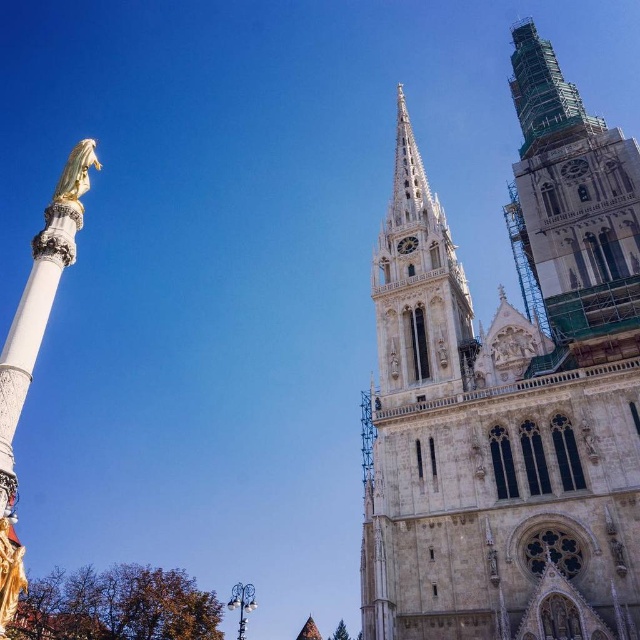
Question: Which object appears closest to the camera in this image?

Choices:
 (A) white marble column at left
 (B) stone spire at center
 (C) green scaffolding at right
 (D) gold polished statue at left

Answer: (A)

Question: Does stone spire at center have a larger size compared to gold polished statue at left?

Choices:
 (A) yes
 (B) no

Answer: (B)

Question: Among these points, which one is farthest from the camera?

Choices:
 (A) (422, 189)
 (B) (13, 419)
 (C) (515, 65)

Answer: (C)

Question: In this image, where is stone spire at center located relative to white marble column at left?

Choices:
 (A) below
 (B) above

Answer: (B)

Question: Is white marble column at left wider than gold polished statue at left?

Choices:
 (A) no
 (B) yes

Answer: (B)

Question: Estimate the real-world distances between objects in this image. Which object is closer to the gold polished statue at left?

Choices:
 (A) green scaffolding at right
 (B) stone spire at center

Answer: (B)